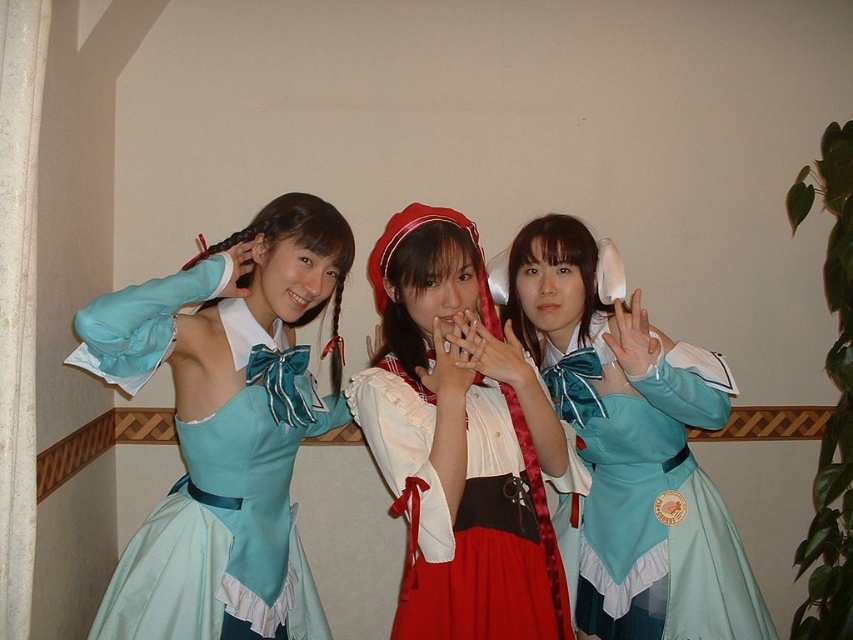
Question: Which of these objects is positioned closest to the matte blue dress at left?

Choices:
 (A) matte blue dress at center
 (B) matte white blouse at center

Answer: (B)

Question: Can you confirm if matte blue dress at left is wider than matte blue dress at center?

Choices:
 (A) yes
 (B) no

Answer: (B)

Question: Is matte blue dress at left thinner than matte blue dress at center?

Choices:
 (A) yes
 (B) no

Answer: (A)

Question: Is matte blue dress at left in front of matte white blouse at center?

Choices:
 (A) yes
 (B) no

Answer: (B)

Question: Among these objects, which one is nearest to the camera?

Choices:
 (A) matte white blouse at center
 (B) matte blue dress at center
 (C) matte blue dress at left

Answer: (A)

Question: Which object is closer to the camera taking this photo?

Choices:
 (A) matte blue dress at center
 (B) matte blue dress at left
 (C) matte white blouse at center

Answer: (C)